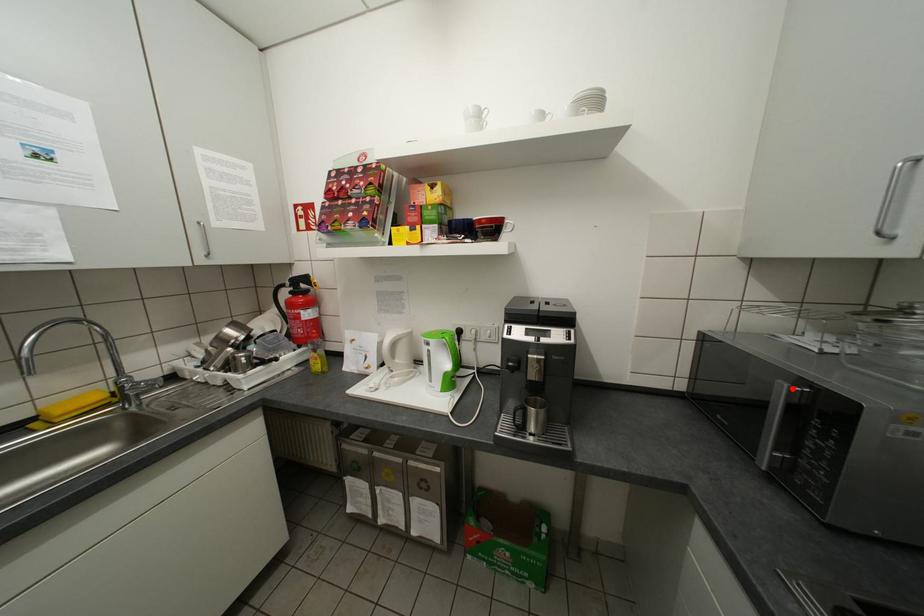
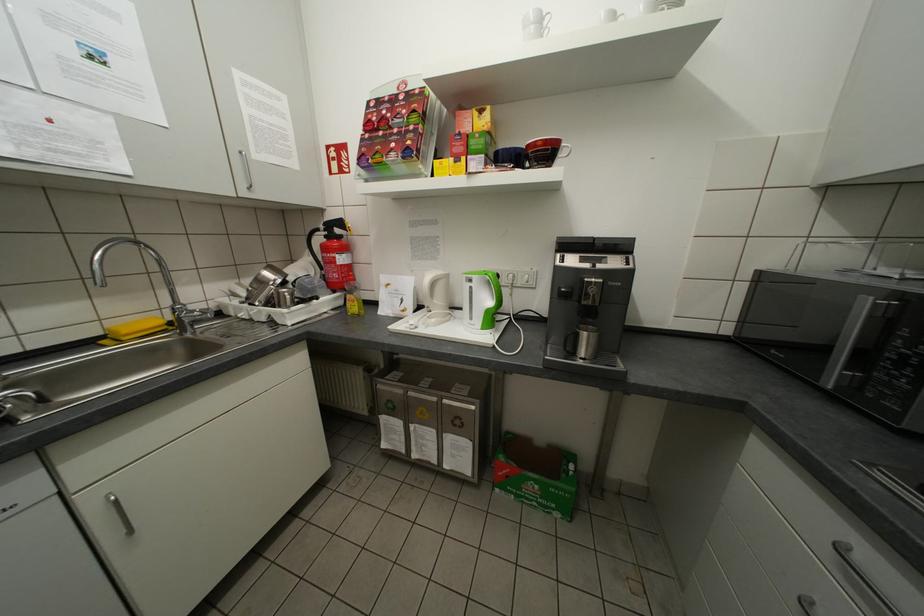
Find the pixel in the second image that matches the highlighted location in the first image.

(877, 302)